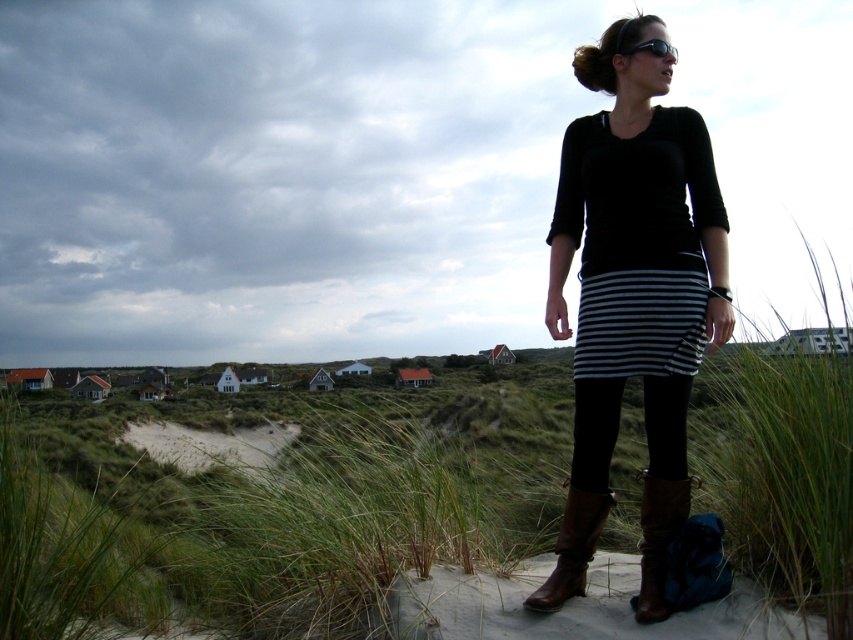
You are a photographer trying to capture the person in the coastal scene. You notice the black striped skirt at center and the brown leather boot at lower right. Which object is taller when viewed from the front?

The black striped skirt at center is taller than the brown leather boot at lower right.

You are a photographer taking a picture of the coastal scene. You notice the black striped dress at center and the black plastic goggles at upper center. Which object appears narrower in the image?

The black striped dress at center appears narrower than the black plastic goggles at upper center because it has a lesser width compared to the goggles.